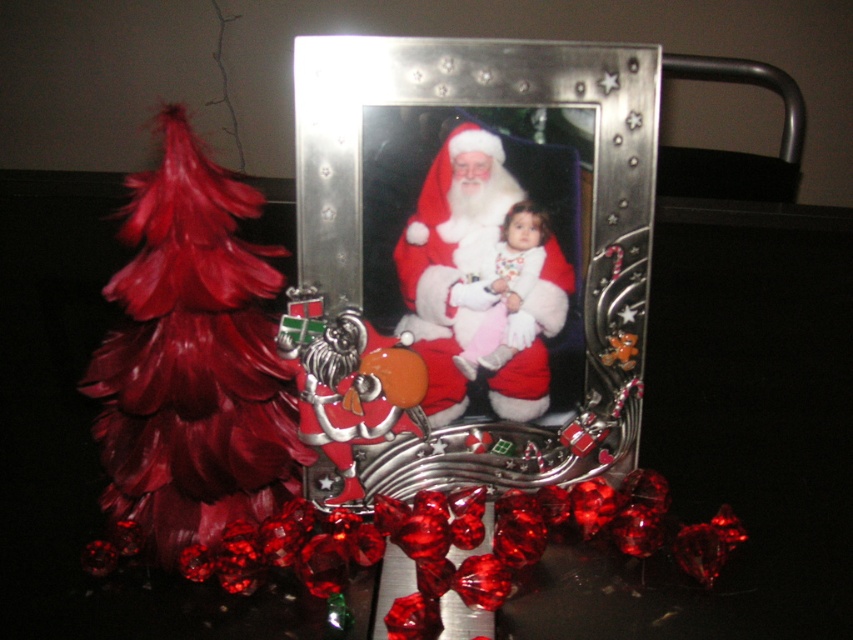
Looking at this image, you are a decorator arranging a Christmas display. You have a velvet santa at center and a white fluffy baby at center. Which object is wider?

The velvet santa at center is wider than the white fluffy baby at center according to the description.

You are a guest at a Christmas party and notice the metallic silver picture frame at center and the velvet santa at center. Which object is closer to you in the arrangement?

The metallic silver picture frame at center is closer to you because it is in front of the velvet santa at center.

You are holding a 28 inch long measuring tape. If you want to measure the distance from yourself to the metallic silver picture frame at center, will the tape be long enough?

The distance between you and the metallic silver picture frame at center is 30.99 inches, which is longer than the 28 inch tape. Therefore, the tape is not long enough to measure the distance.